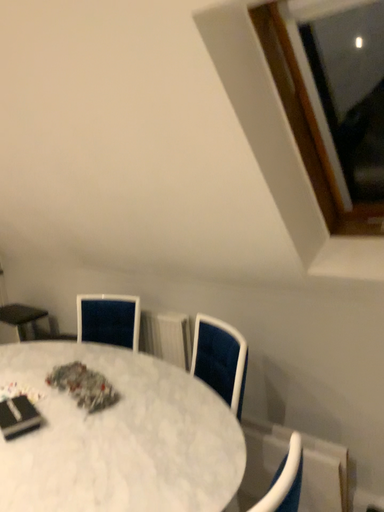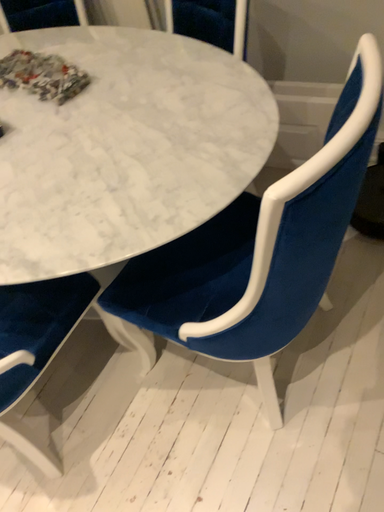
Question: How did the camera likely rotate when shooting the video?

Choices:
 (A) rotated left
 (B) rotated right

Answer: (B)